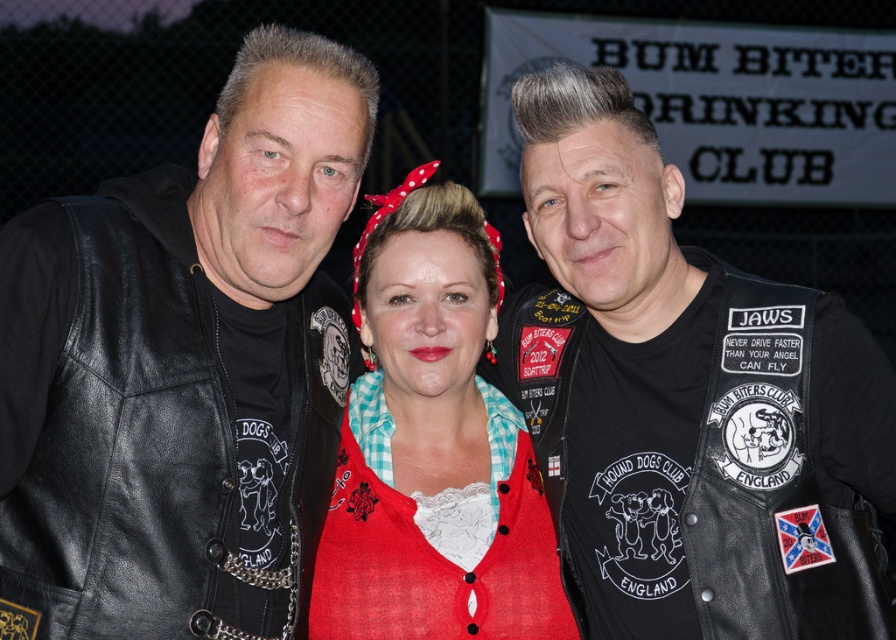
Question: Which point is farther to the camera?

Choices:
 (A) (220, 557)
 (B) (816, 307)
 (C) (442, 365)

Answer: (C)

Question: Can you confirm if black leather jacket at left is bigger than matte red cardigan at center?

Choices:
 (A) no
 (B) yes

Answer: (B)

Question: Which point is closer to the camera taking this photo?

Choices:
 (A) (326, 348)
 (B) (362, 532)
 (C) (672, 202)

Answer: (C)

Question: Can you confirm if black leather jacket at left is positioned to the right of matte red cardigan at center?

Choices:
 (A) no
 (B) yes

Answer: (A)

Question: Is leather vest at center behind black leather jacket at left?

Choices:
 (A) no
 (B) yes

Answer: (B)

Question: Which point appears closest to the camera in this image?

Choices:
 (A) (74, 486)
 (B) (797, 440)
 (C) (388, 570)

Answer: (A)